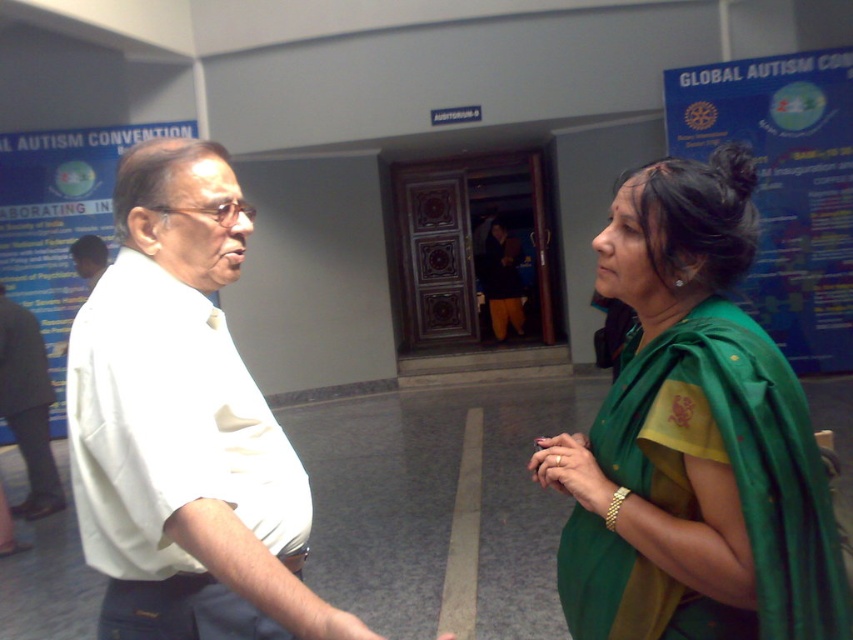
You are an interior designer who needs to place a new decorative item exactly at the center of the room. However, there is already a green silk saree at center. Where should you place the new item to avoid overlapping with the saree?

The green silk saree at center is already located at the center of the room at point (693, 438), so you should place the new decorative item elsewhere to avoid overlapping.